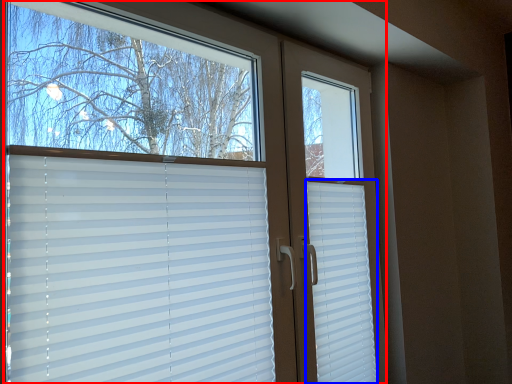
Question: Among these objects, which one is nearest to the camera, window (highlighted by a red box) or shutter (highlighted by a blue box)?

Choices:
 (A) window
 (B) shutter

Answer: (A)